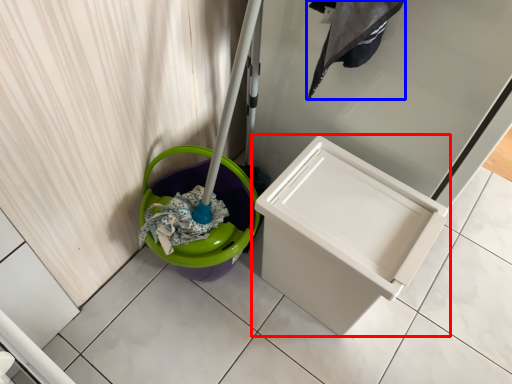
Question: Which object is further to the camera taking this photo, waste container (highlighted by a red box) or laundry (highlighted by a blue box)?

Choices:
 (A) waste container
 (B) laundry

Answer: (A)